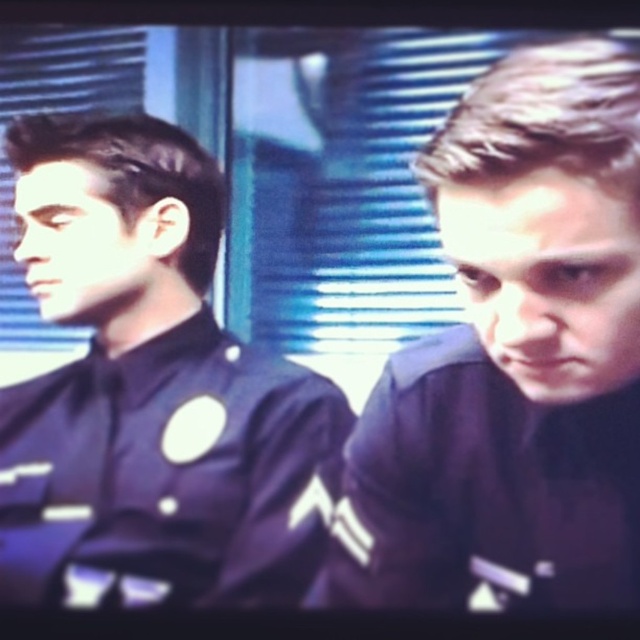
Question: Which point is closer to the camera?

Choices:
 (A) (500, 476)
 (B) (152, 189)

Answer: (A)

Question: Observing the image, what is the correct spatial positioning of matte black uniform at left in reference to dark blue uniform at right?

Choices:
 (A) left
 (B) right

Answer: (A)

Question: Does matte black uniform at left have a smaller size compared to dark blue uniform at right?

Choices:
 (A) no
 (B) yes

Answer: (A)

Question: Is matte black uniform at left above dark blue uniform at right?

Choices:
 (A) yes
 (B) no

Answer: (A)

Question: Which of the following is the farthest from the observer?

Choices:
 (A) (28, 417)
 (B) (416, 353)

Answer: (B)

Question: Which point is closer to the camera?

Choices:
 (A) (432, 556)
 (B) (8, 452)

Answer: (A)